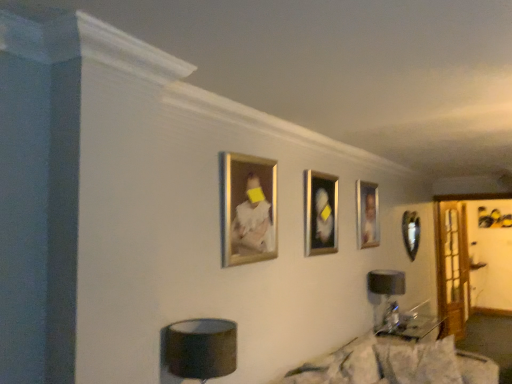
Question: Is black fabric table lamp at lower right, which is the 1th table lamp from back to front, shorter than gold metallic picture frame at upper center, which appears as the first picture frame when viewed from the left?

Choices:
 (A) yes
 (B) no

Answer: (A)

Question: Is black fabric table lamp at lower right, which ranks as the first table lamp in right-to-left order, smaller than gold metallic picture frame at upper center, which appears as the first picture frame when viewed from the left?

Choices:
 (A) no
 (B) yes

Answer: (A)

Question: From a real-world perspective, is black fabric table lamp at lower right, marked as the 2th table lamp in a front-to-back arrangement, on gold metallic picture frame at upper center, marked as the fourth picture frame in a right-to-left arrangement?

Choices:
 (A) yes
 (B) no

Answer: (B)

Question: From a real-world perspective, is black fabric table lamp at lower right, marked as the 2th table lamp in a front-to-back arrangement, positioned under gold metallic picture frame at upper center, which appears as the first picture frame when viewed from the left, based on gravity?

Choices:
 (A) no
 (B) yes

Answer: (B)

Question: From the image's perspective, is black fabric table lamp at lower right, the 2th table lamp when ordered from left to right, under gold metallic picture frame at upper center, the fourth picture frame when ordered from back to front?

Choices:
 (A) no
 (B) yes

Answer: (B)

Question: Is metallic silver picture frame at center, which is counted as the 2th picture frame, starting from the left, situated inside fluffy white couch at lower right or outside?

Choices:
 (A) inside
 (B) outside

Answer: (B)

Question: From the image's perspective, is metallic silver picture frame at center, which appears as the second picture frame when viewed from the front, above or below fluffy white couch at lower right?

Choices:
 (A) above
 (B) below

Answer: (A)

Question: From a real-world perspective, is metallic silver picture frame at center, which is counted as the 2th picture frame, starting from the left, above or below fluffy white couch at lower right?

Choices:
 (A) below
 (B) above

Answer: (B)

Question: Is metallic silver picture frame at center, positioned as the 3th picture frame in right-to-left order, to the left or to the right of fluffy white couch at lower right in the image?

Choices:
 (A) right
 (B) left

Answer: (A)

Question: Considering the positions of gold metallic picture frame at upper center, which appears as the first picture frame when viewed from the left, and metallic silver picture frame at right, which is the 1th picture frame from back to front, in the image, is gold metallic picture frame at upper center, which appears as the first picture frame when viewed from the left, bigger or smaller than metallic silver picture frame at right, which is the 1th picture frame from back to front,?

Choices:
 (A) big
 (B) small

Answer: (B)

Question: Considering the positions of gold metallic picture frame at upper center, the fourth picture frame when ordered from back to front, and metallic silver picture frame at right, which is the fourth picture frame in front-to-back order, in the image, is gold metallic picture frame at upper center, the fourth picture frame when ordered from back to front, wider or thinner than metallic silver picture frame at right, which is the fourth picture frame in front-to-back order,?

Choices:
 (A) thin
 (B) wide

Answer: (B)

Question: Would you say gold metallic picture frame at upper center, marked as the fourth picture frame in a right-to-left arrangement, is to the left or to the right of metallic silver picture frame at right, which is the 1th picture frame from back to front, in the picture?

Choices:
 (A) right
 (B) left

Answer: (B)

Question: From a real-world perspective, is gold metallic picture frame at upper center, which appears as the first picture frame when viewed from the left, physically located above or below metallic silver picture frame at right, the 4th picture frame viewed from the left?

Choices:
 (A) below
 (B) above

Answer: (B)

Question: Is gold-framed portrait at center, which is the 3th picture frame from front to back, taller or shorter than clear glass door at right?

Choices:
 (A) short
 (B) tall

Answer: (A)

Question: Is gold-framed portrait at center, placed as the third picture frame when sorted from left to right, wider or thinner than clear glass door at right?

Choices:
 (A) thin
 (B) wide

Answer: (A)